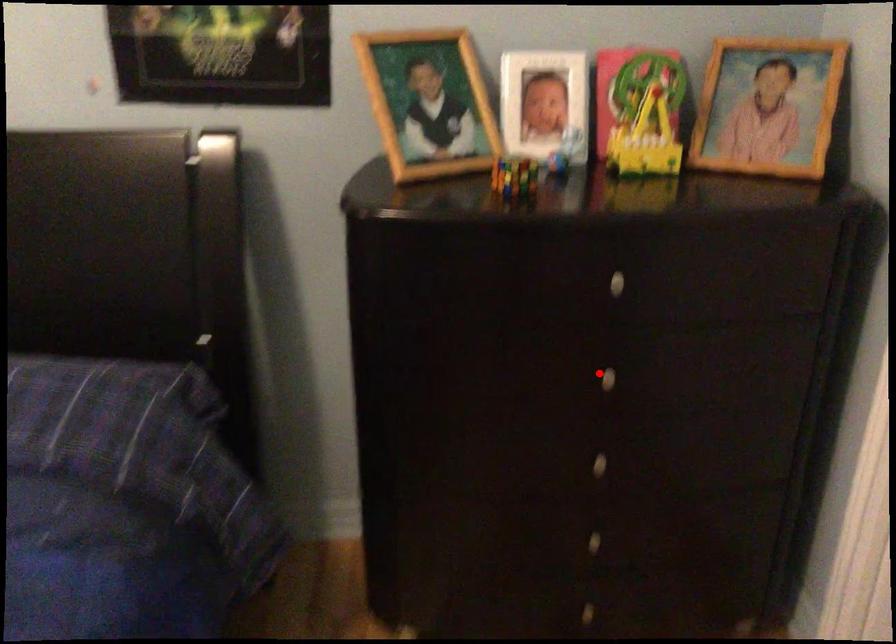
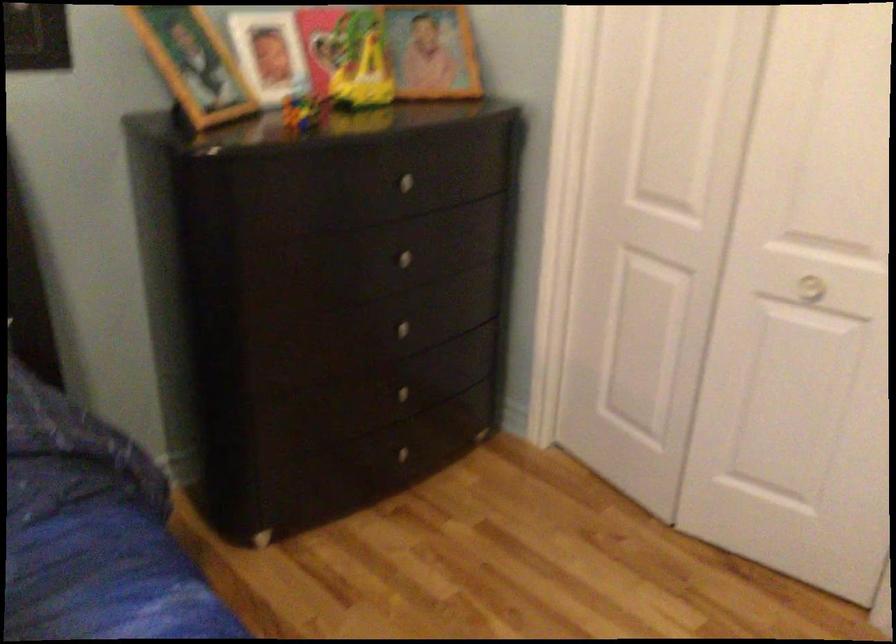
Question: A red point is marked in image1. In image2, is the corresponding 3D point closer to the camera or farther? Reply with the corresponding letter.

Choices:
 (A) The corresponding 3D point is closer.
 (B) The corresponding 3D point is farther.

Answer: (B)